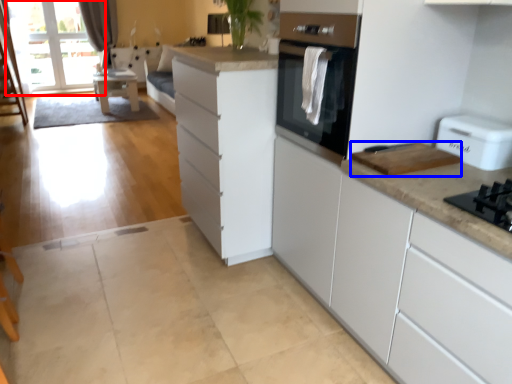
Question: Which point is further to the camera, window screen (highlighted by a red box) or appliance (highlighted by a blue box)?

Choices:
 (A) window screen
 (B) appliance

Answer: (A)